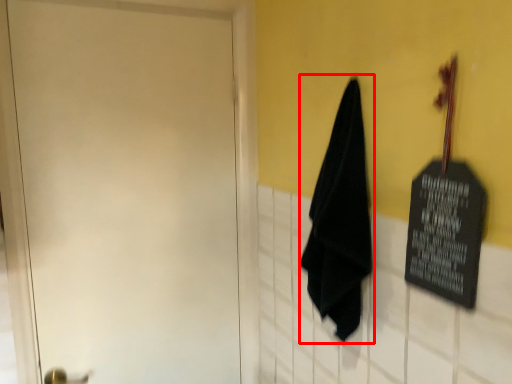
Question: Observing the image, what is the correct spatial positioning of cloth (annotated by the red box) in reference to door?

Choices:
 (A) right
 (B) left

Answer: (A)